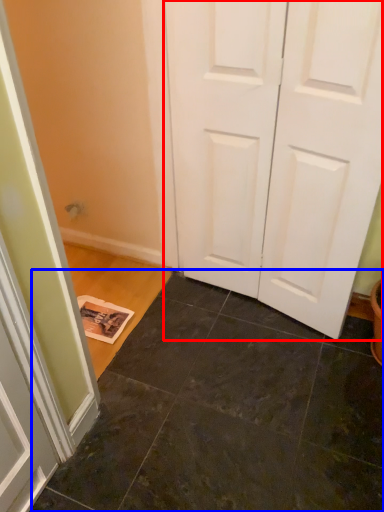
Question: Which of the following is the closest to the observer, door (highlighted by a red box) or tile (highlighted by a blue box)?

Choices:
 (A) door
 (B) tile

Answer: (B)